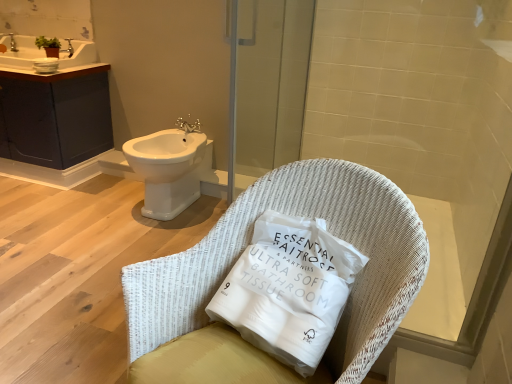
Find the location of a particular element. free point to the left of white glossy bidet at left is located at coordinates (93, 202).